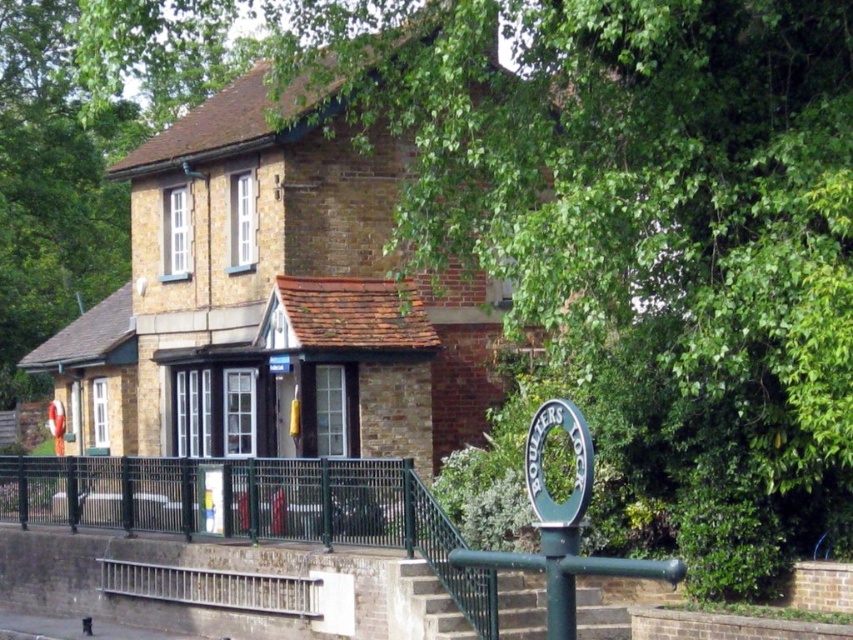
Question: Considering the real-world distances, which object is closest to the green metal railing at lower center?

Choices:
 (A) green plastic sign at lower right
 (B) green metallic pole at lower right

Answer: (A)

Question: Which of the following is the farthest from the observer?

Choices:
 (A) green plastic sign at lower right
 (B) green metal railing at lower center
 (C) green metallic pole at lower right

Answer: (A)

Question: Which object is the closest to the green metal railing at lower center?

Choices:
 (A) green plastic sign at lower right
 (B) green metallic pole at lower right

Answer: (A)

Question: Can you confirm if green plastic sign at lower right is smaller than green metallic pole at lower right?

Choices:
 (A) no
 (B) yes

Answer: (A)

Question: Is green metal railing at lower center closer to camera compared to green plastic sign at lower right?

Choices:
 (A) no
 (B) yes

Answer: (B)

Question: Observing the image, what is the correct spatial positioning of green metal railing at lower center in reference to green plastic sign at lower right?

Choices:
 (A) above
 (B) below

Answer: (B)